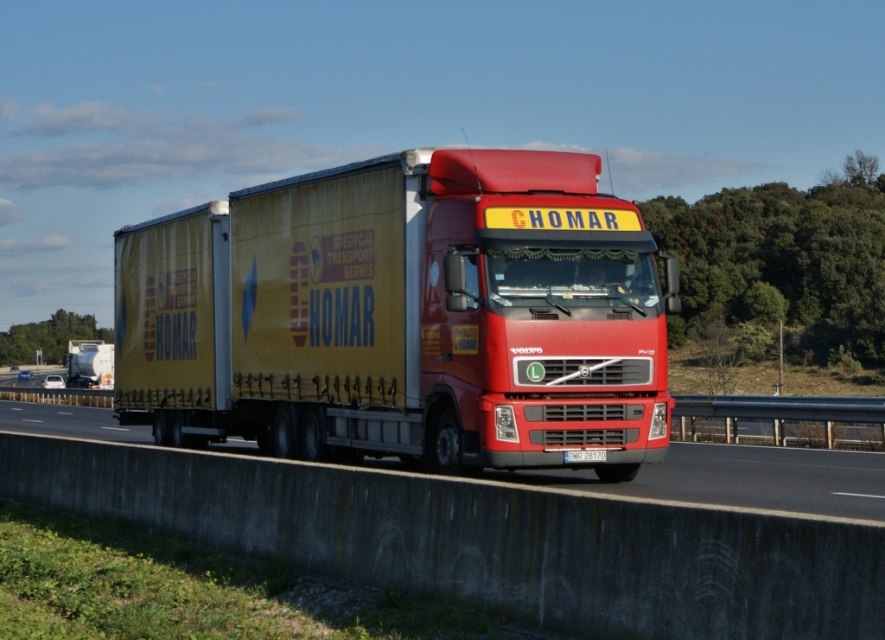
Does matte yellow trailer truck at center lie in front of white plastic license plate at center?

Yes, matte yellow trailer truck at center is closer to the viewer.

Which is behind, point (526, 444) or point (583, 451)?

The point (583, 451) is more distant.

Locate an element on the screen. This screenshot has height=640, width=885. matte yellow trailer truck at center is located at coordinates (401, 316).

In the scene shown: Is red matte truck at center closer to camera compared to matte yellow trailer at center?

Yes, red matte truck at center is in front of matte yellow trailer at center.

The height and width of the screenshot is (640, 885). Identify the location of red matte truck at center. (x=743, y=477).

Who is more distant from viewer, (394,360) or (4,429)?

Point (4,429)

The image size is (885, 640). I want to click on matte yellow trailer truck at center, so click(x=401, y=316).

Locate an element on the screen. The height and width of the screenshot is (640, 885). matte yellow trailer truck at center is located at coordinates (401, 316).